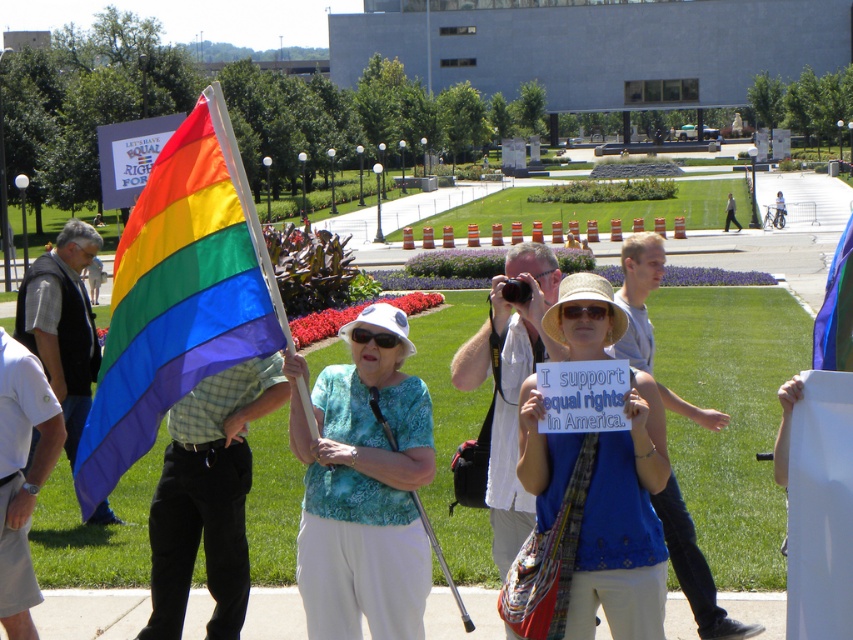
What object is located at the coordinates point (x=364, y=488) in the image?

The point (x=364, y=488) corresponds to the white fabric hat at center.

You are a photographer trying to capture a clear shot of both the white fabric hat at center and the blue fabric sign at center. Since you want to ensure both are visible, which object should you focus on first considering their size in the frame?

Answer: The white fabric hat at center occupies less space than the blue fabric sign at center, so you should focus on the blue fabric sign at center first as it is larger and more prominent in the frame.

What object is located at the coordinates point (177, 296)?

The rainbow fabric flag at left is located at point (177, 296).